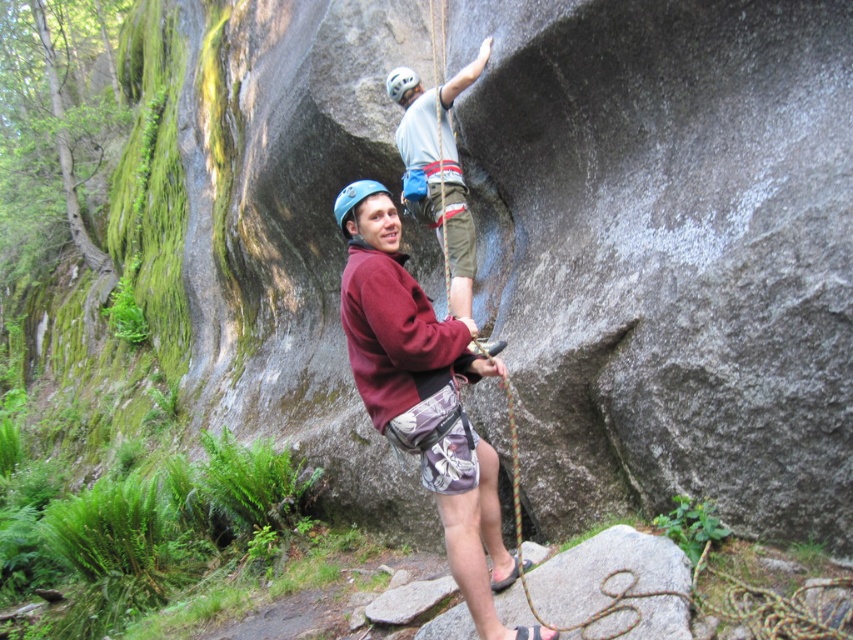
Question: Can you confirm if matte gray helmet at upper center is positioned above blue matte helmet at center?

Choices:
 (A) yes
 (B) no

Answer: (A)

Question: Does matte gray helmet at upper center appear under blue matte helmet at center?

Choices:
 (A) no
 (B) yes

Answer: (A)

Question: Which object appears farthest from the camera in this image?

Choices:
 (A) white matte helmet at upper center
 (B) blue matte helmet at center

Answer: (A)

Question: Which point is farther from the camera taking this photo?

Choices:
 (A) (399, 80)
 (B) (444, 438)
 (C) (351, 189)
 (D) (459, 218)

Answer: (A)

Question: Observing the image, what is the correct spatial positioning of matte gray helmet at upper center in reference to blue matte helmet at center?

Choices:
 (A) right
 (B) left

Answer: (A)

Question: Which is nearer to the maroon fleece jacket at center?

Choices:
 (A) blue matte helmet at center
 (B) matte gray helmet at upper center
 (C) white matte helmet at upper center

Answer: (A)